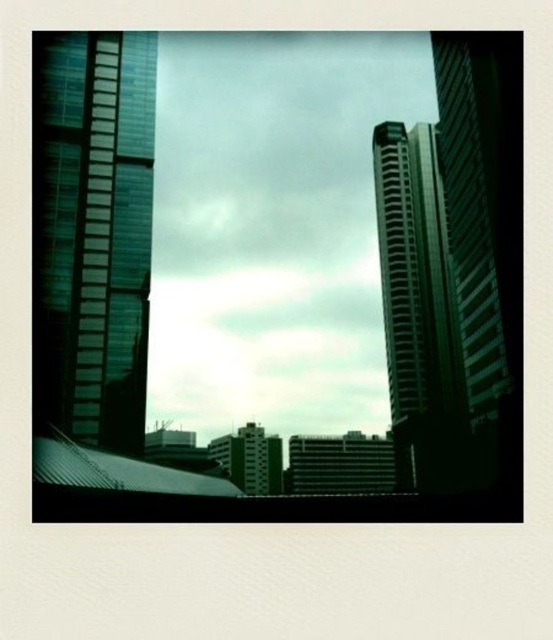
Is green glass building at left in front of glossy glass tower at right?

Yes, green glass building at left is in front of glossy glass tower at right.

Looking at this image, who is shorter, green glass building at left or glossy glass tower at right?

Standing shorter between the two is green glass building at left.

Between point (129, 70) and point (424, 465), which one is positioned in front?

Point (129, 70)

Find the location of a particular element. green glass building at left is located at coordinates (92, 234).

Does green glass building at right appear under glossy glass tower at right?

Actually, green glass building at right is above glossy glass tower at right.

Does point (519, 384) lie in front of point (427, 406)?

Yes.

Find the location of a particular element. green glass building at right is located at coordinates (484, 234).

Describe the element at coordinates (92, 234) in the screenshot. This screenshot has height=640, width=553. I see `green glass building at left` at that location.

Where is `green glass building at left`? The image size is (553, 640). green glass building at left is located at coordinates (92, 234).